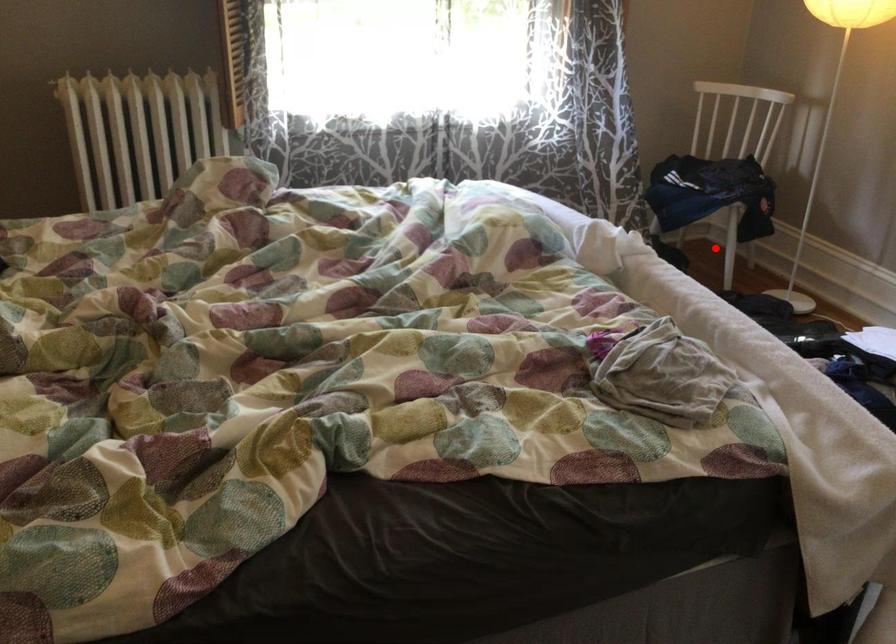
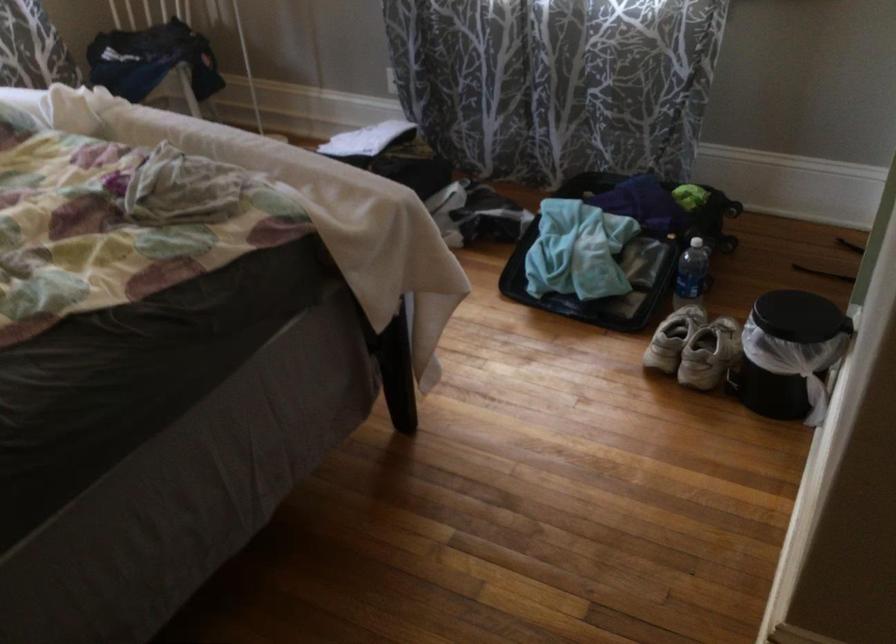
Question: I am providing you with two images of the same scene from different viewpoints. A red point is marked on the first image. At the location where the point appears in image 1, is it still visible in image 2?

Choices:
 (A) Yes
 (B) No

Answer: (B)